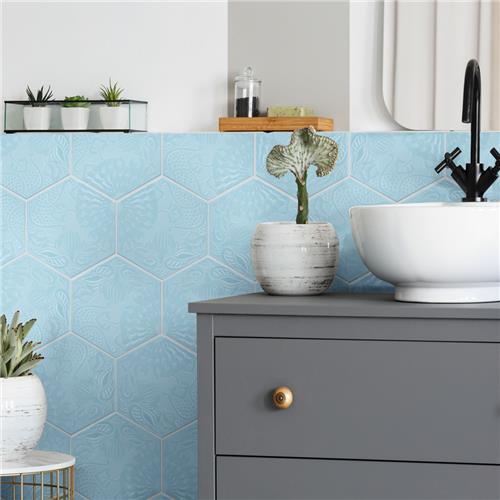
Identify the location of counter. This screenshot has width=500, height=500. (351, 288).